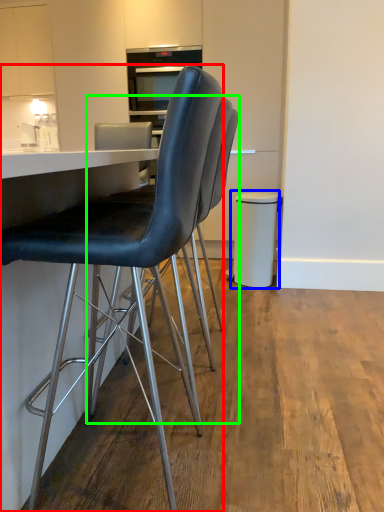
Question: Which is farther away from chair (highlighted by a red box)? bar stool (highlighted by a blue box) or chair (highlighted by a green box)?

Choices:
 (A) bar stool
 (B) chair

Answer: (A)